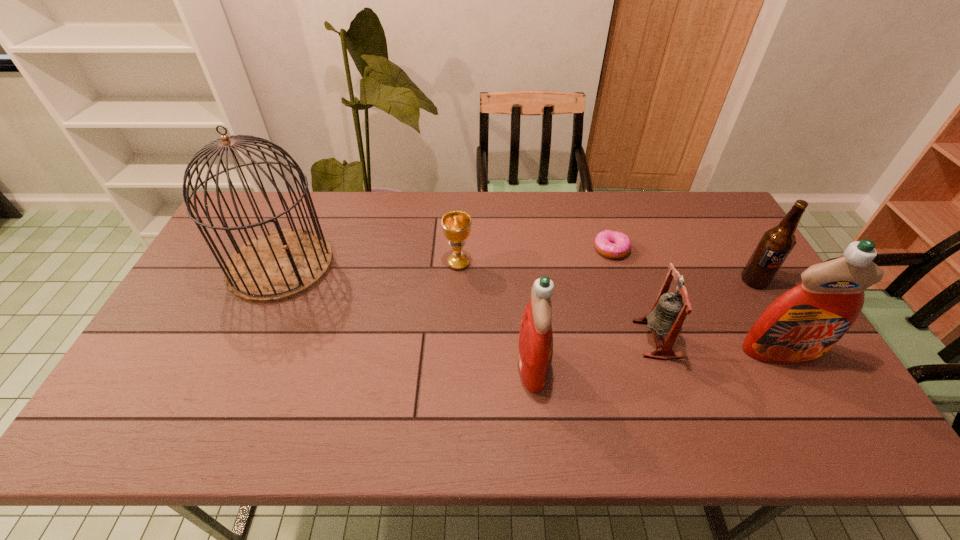
This screenshot has width=960, height=540. What are the coordinates of `vacant area between the fifth object from right to left and the second object from left to right` in the screenshot? It's located at (495, 314).

You are a GUI agent. You are given a task and a screenshot of the screen. Output one action in this format:
    pyautogui.click(x=<x>, y=<y>)
    Task: Click on the vacant space that's between the leftmost object and the shortest object
    
    Given the screenshot: What is the action you would take?
    pyautogui.click(x=445, y=257)

The image size is (960, 540). What are the coordinates of `vacant point located between the tallest object and the doughnut` in the screenshot? It's located at (445, 257).

The image size is (960, 540). Identify the location of vacant space that's between the right detergent and the fifth tallest object. (719, 345).

The height and width of the screenshot is (540, 960). Find the location of `vacant space in between the chalice and the beer bottle`. vacant space in between the chalice and the beer bottle is located at coordinates (606, 272).

The width and height of the screenshot is (960, 540). In order to click on free spot between the shortest object and the sixth tallest object in this screenshot , I will do `click(535, 256)`.

The width and height of the screenshot is (960, 540). Find the location of `free space between the shortest object and the beer bottle`. free space between the shortest object and the beer bottle is located at coordinates (683, 265).

At what (x,y) coordinates should I click in order to perform the action: click on vacant space that is in between the right detergent and the shortest object. Please return your answer as a coordinate pair (x, y). Looking at the image, I should click on (696, 300).

Identify the location of blank region between the third shortest object and the sixth tallest object. (558, 301).

Identify the location of vacant point located between the fifth object from right to left and the second shortest object. Image resolution: width=960 pixels, height=540 pixels. (495, 314).